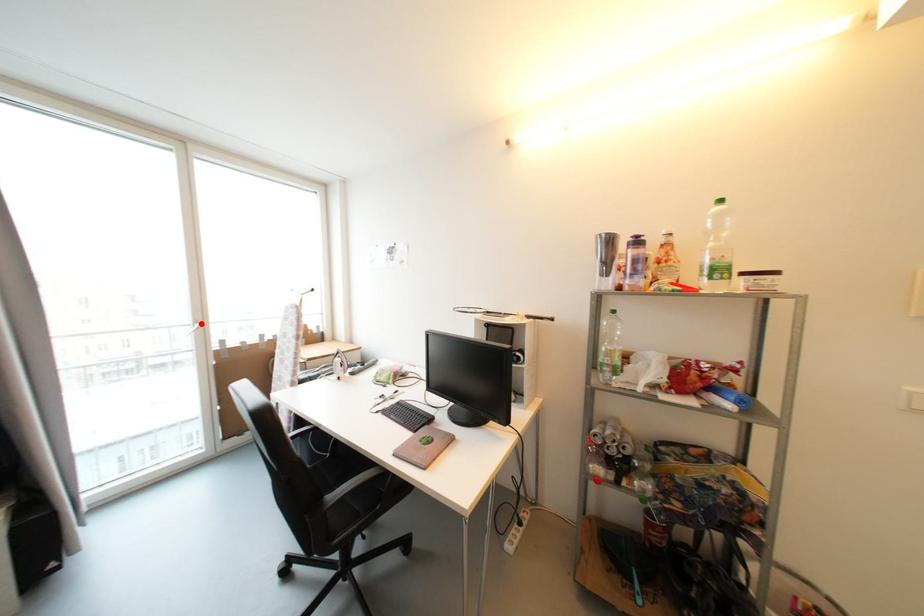
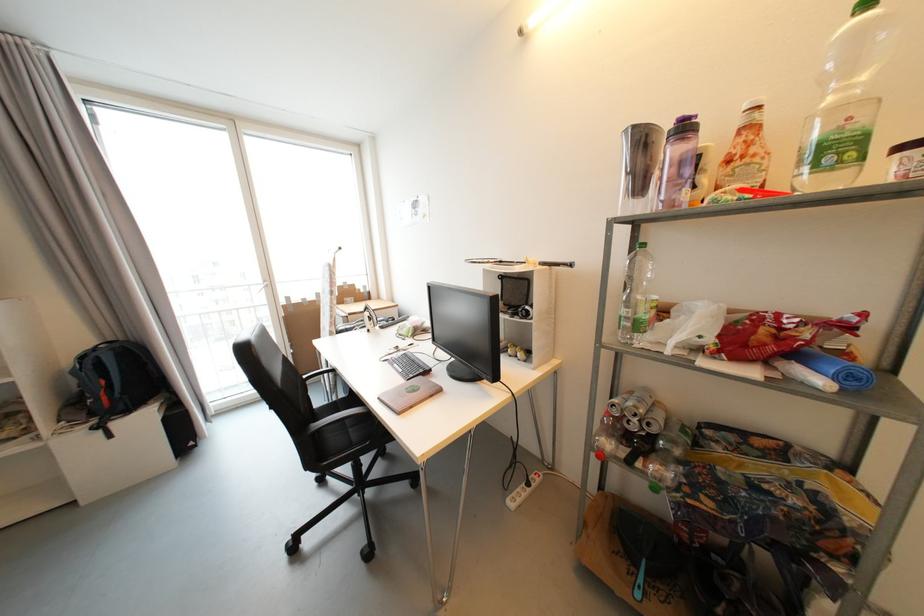
Where in the second image is the point corresponding to the highlighted location from the first image?

(271, 283)